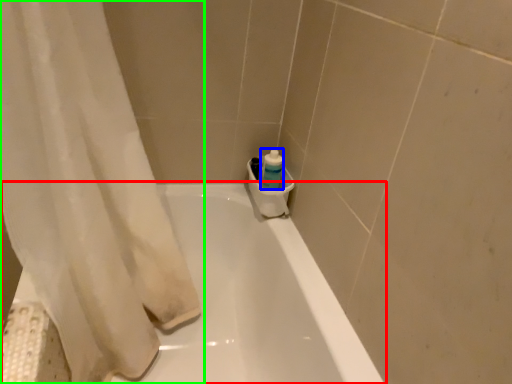
Question: Which is farther away from bathtub (highlighted by a red box)? cleaning product (highlighted by a blue box) or curtain (highlighted by a green box)?

Choices:
 (A) cleaning product
 (B) curtain

Answer: (A)